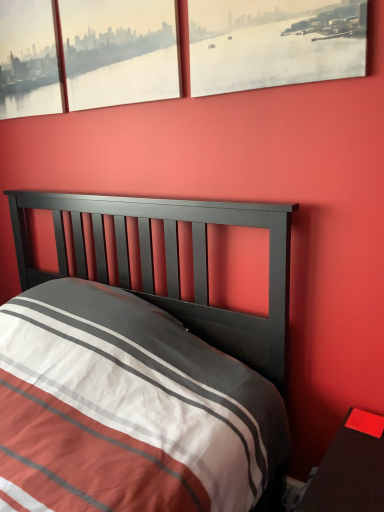
Question: Does matte glass window at upper left, the 3th window viewed from the right, come behind matte paper cityscape at upper right, the 3th window in the left-to-right sequence?

Choices:
 (A) yes
 (B) no

Answer: (A)

Question: Is matte glass window at upper left, the 3th window viewed from the right, positioned far away from matte paper cityscape at upper right, positioned as the 1th window in right-to-left order?

Choices:
 (A) no
 (B) yes

Answer: (A)

Question: Is matte glass window at upper left, the 3th window viewed from the right, turned away from matte paper cityscape at upper right, positioned as the 1th window in right-to-left order?

Choices:
 (A) yes
 (B) no

Answer: (B)

Question: Is matte glass window at upper left, acting as the first window starting from the left, facing towards matte paper cityscape at upper right, positioned as the 1th window in right-to-left order?

Choices:
 (A) no
 (B) yes

Answer: (A)

Question: Considering the relative sizes of matte glass window at upper left, acting as the first window starting from the left, and matte paper cityscape at upper right, positioned as the 1th window in right-to-left order, in the image provided, is matte glass window at upper left, acting as the first window starting from the left, shorter than matte paper cityscape at upper right, positioned as the 1th window in right-to-left order,?

Choices:
 (A) no
 (B) yes

Answer: (A)

Question: Is matte glass window at upper left, the 3th window viewed from the right, completely or partially outside of matte paper cityscape at upper right, positioned as the 1th window in right-to-left order?

Choices:
 (A) no
 (B) yes

Answer: (B)

Question: Can you confirm if matte glass window at upper left, arranged as the 2th window when viewed from the left, is positioned to the left of smooth glossy wood nightstand at lower right?

Choices:
 (A) no
 (B) yes

Answer: (B)

Question: Can you confirm if matte glass window at upper left, arranged as the second window when viewed from the right, is thinner than smooth glossy wood nightstand at lower right?

Choices:
 (A) no
 (B) yes

Answer: (B)

Question: Is matte glass window at upper left, arranged as the second window when viewed from the right, oriented towards smooth glossy wood nightstand at lower right?

Choices:
 (A) no
 (B) yes

Answer: (A)

Question: From a real-world perspective, is matte glass window at upper left, arranged as the second window when viewed from the right, over smooth glossy wood nightstand at lower right?

Choices:
 (A) no
 (B) yes

Answer: (B)

Question: Does matte glass window at upper left, arranged as the second window when viewed from the right, have a greater height compared to smooth glossy wood nightstand at lower right?

Choices:
 (A) yes
 (B) no

Answer: (B)

Question: Is matte glass window at upper left, arranged as the second window when viewed from the right, smaller than smooth glossy wood nightstand at lower right?

Choices:
 (A) no
 (B) yes

Answer: (B)

Question: Can you confirm if smooth glossy wood nightstand at lower right is thinner than matte paper cityscape at upper right, the 3th window in the left-to-right sequence?

Choices:
 (A) no
 (B) yes

Answer: (A)